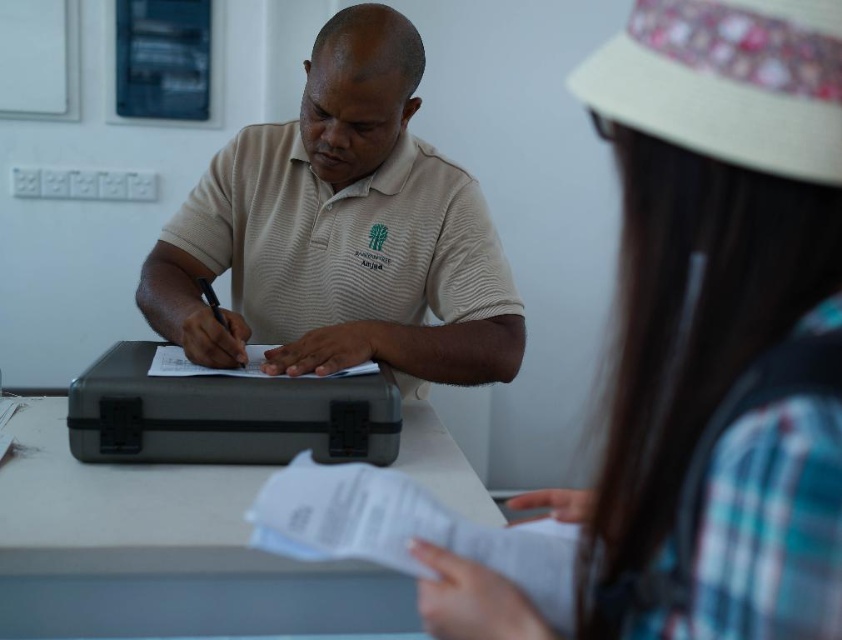
Does point (653, 404) come farther from viewer compared to point (497, 544)?

No, it is in front of (497, 544).

Between plaid fabric shirt at upper right and white paper at lower center, which one appears on the left side from the viewer's perspective?

white paper at lower center

Who is more distant from viewer, (723, 88) or (518, 529)?

Positioned behind is point (518, 529).

Find the location of a particular element. The width and height of the screenshot is (842, 640). plaid fabric shirt at upper right is located at coordinates (718, 326).

Between beige striped polo shirt at center and white paper at lower center, which one is positioned higher?

Positioned higher is beige striped polo shirt at center.

Is beige striped polo shirt at center to the right of white paper at lower center from the viewer's perspective?

Incorrect, beige striped polo shirt at center is not on the right side of white paper at lower center.

The image size is (842, 640). Describe the element at coordinates (340, 230) in the screenshot. I see `beige striped polo shirt at center` at that location.

At what (x,y) coordinates should I click in order to perform the action: click on beige striped polo shirt at center. Please return your answer as a coordinate pair (x, y). Looking at the image, I should click on coord(340,230).

Between plaid fabric shirt at upper right and matte gray briefcase at center, which one is positioned lower?

matte gray briefcase at center is below.

Image resolution: width=842 pixels, height=640 pixels. I want to click on plaid fabric shirt at upper right, so click(x=718, y=326).